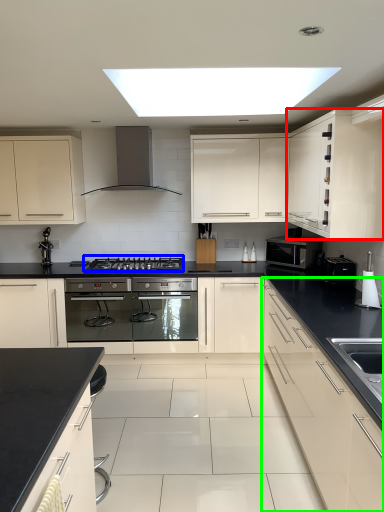
Question: Which object is positioned farthest from cabinetry (highlighted by a red box)? Select from gas stove (highlighted by a blue box) and cabinetry (highlighted by a green box).

Choices:
 (A) gas stove
 (B) cabinetry

Answer: (A)